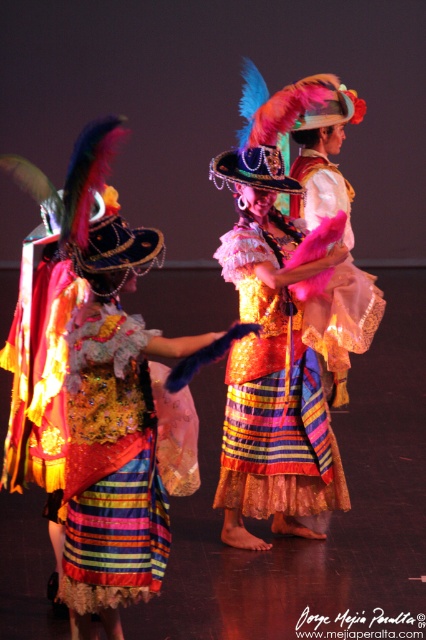
Question: Which object is closer to the camera taking this photo?

Choices:
 (A) shiny pink fabric at center
 (B) shiny sequined skirt at center
 (C) shiny sequined dress at center

Answer: (C)

Question: Among these points, which one is nearest to the camera?

Choices:
 (A) (330, 172)
 (B) (282, 326)

Answer: (B)

Question: Does shiny sequined dress at center appear under shiny sequined skirt at center?

Choices:
 (A) no
 (B) yes

Answer: (B)

Question: Can you confirm if shiny sequined dress at center is positioned to the right of shiny pink fabric at center?

Choices:
 (A) yes
 (B) no

Answer: (B)

Question: Which point is farther from the camera taking this photo?

Choices:
 (A) (325, 506)
 (B) (111, 333)
 (C) (299, 164)

Answer: (C)

Question: Observing the image, what is the correct spatial positioning of shiny sequined dress at center in reference to shiny sequined skirt at center?

Choices:
 (A) left
 (B) right

Answer: (A)